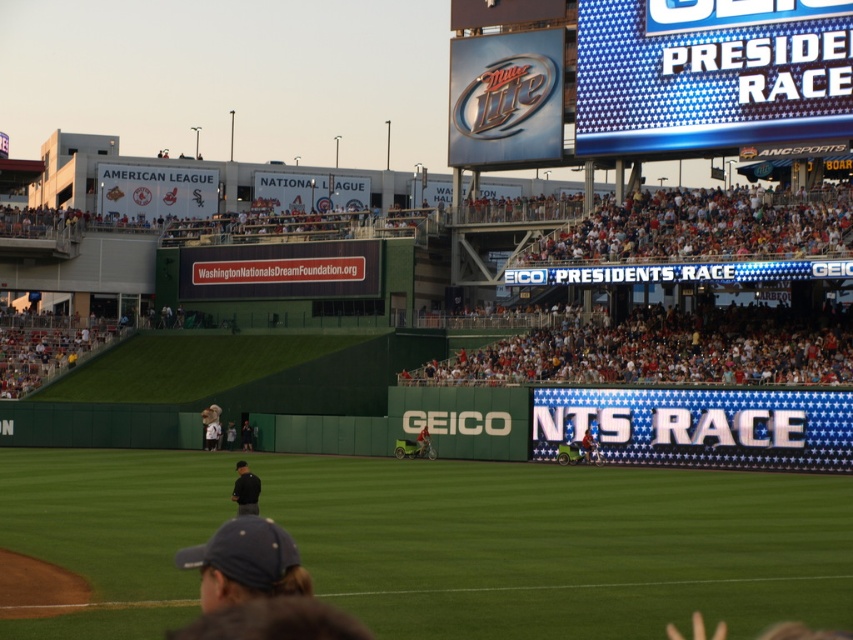
You are standing at the center of the baseball field and see the dark blue fabric cap at lower center. If you walk straight towards the direction of the cap, will you exit the field before reaching it?

The dark blue fabric cap at lower center is located at point (245, 563). Since the field boundaries are marked by white lines in the foreground, walking straight towards the cap would lead you towards the edge of the field, so you would exit the field before reaching the cap.

You are standing at the center of the baseball field and want to locate the white fabric person at lower left. According to the coordinate system where the bottom left corner is 0,0 and the top right is 1,1, where would you look?

The white fabric person at lower left is located at coordinate point (x=212, y=426), so you should look towards the lower left area of the image, specifically at the coordinates mentioned.